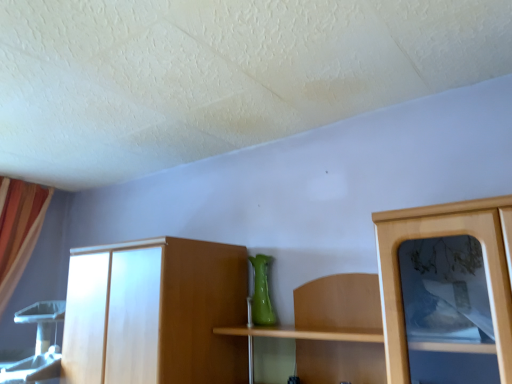
Question: Does green matte vase at center have a larger size compared to orange fabric curtain at left?

Choices:
 (A) yes
 (B) no

Answer: (B)

Question: Is green matte vase at center to the right of orange fabric curtain at left from the viewer's perspective?

Choices:
 (A) yes
 (B) no

Answer: (A)

Question: Considering the relative sizes of green matte vase at center and orange fabric curtain at left in the image provided, is green matte vase at center thinner than orange fabric curtain at left?

Choices:
 (A) yes
 (B) no

Answer: (A)

Question: From the image's perspective, is green matte vase at center below orange fabric curtain at left?

Choices:
 (A) no
 (B) yes

Answer: (A)

Question: Does green matte vase at center have a smaller size compared to orange fabric curtain at left?

Choices:
 (A) yes
 (B) no

Answer: (A)

Question: Is green matte vase at center further to camera compared to orange fabric curtain at left?

Choices:
 (A) yes
 (B) no

Answer: (B)

Question: Would you say green matte vase at center is part of orange fabric curtain at left's contents?

Choices:
 (A) yes
 (B) no

Answer: (B)

Question: Is orange fabric curtain at left to the left of green matte vase at center from the viewer's perspective?

Choices:
 (A) yes
 (B) no

Answer: (A)

Question: Are orange fabric curtain at left and green matte vase at center located far from each other?

Choices:
 (A) yes
 (B) no

Answer: (A)

Question: Does orange fabric curtain at left have a greater height compared to green matte vase at center?

Choices:
 (A) no
 (B) yes

Answer: (B)

Question: From the image's perspective, is orange fabric curtain at left below green matte vase at center?

Choices:
 (A) no
 (B) yes

Answer: (B)

Question: Does orange fabric curtain at left have a larger size compared to green matte vase at center?

Choices:
 (A) yes
 (B) no

Answer: (A)

Question: From a real-world perspective, is green matte vase at center above or below orange fabric curtain at left?

Choices:
 (A) above
 (B) below

Answer: (B)